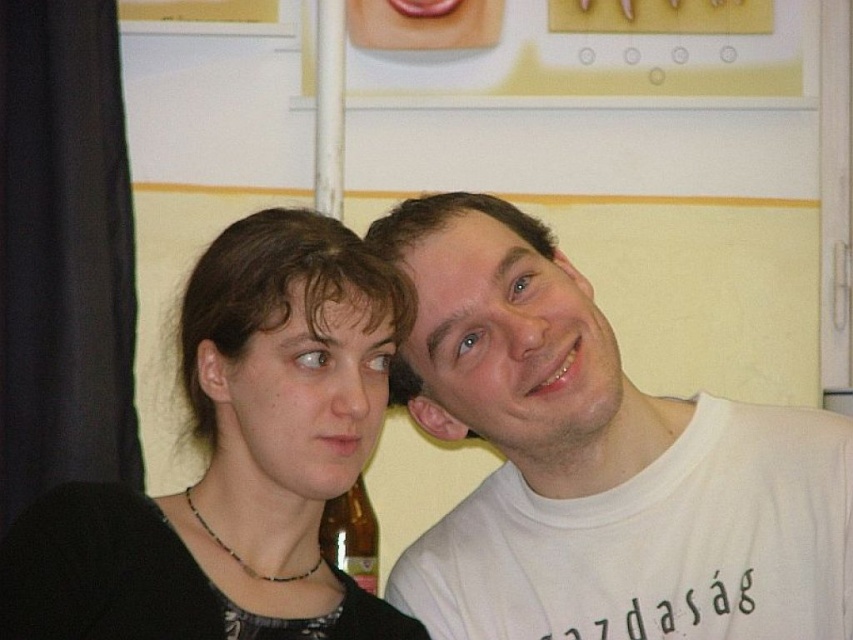
Question: Where is black matte hair at center located in relation to translucent glass bottle at lower center in the image?

Choices:
 (A) right
 (B) left

Answer: (A)

Question: Does white cotton t-shirt at right appear under black matte hair at center?

Choices:
 (A) no
 (B) yes

Answer: (A)

Question: From the image, what is the correct spatial relationship of black matte hair at center in relation to translucent glass bottle at lower center?

Choices:
 (A) above
 (B) below

Answer: (A)

Question: Which of the following is the farthest from the observer?

Choices:
 (A) white cotton t-shirt at right
 (B) black matte hair at center
 (C) translucent glass bottle at lower center

Answer: (C)

Question: Estimate the real-world distances between objects in this image. Which object is closer to the black matte hair at center?

Choices:
 (A) translucent glass bottle at lower center
 (B) white cotton t-shirt at right

Answer: (B)

Question: Among these objects, which one is nearest to the camera?

Choices:
 (A) translucent glass bottle at lower center
 (B) white cotton t-shirt at right

Answer: (B)